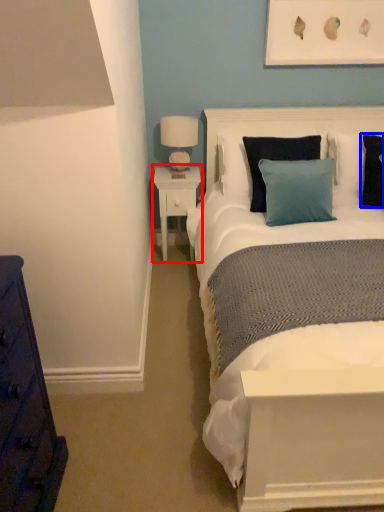
Question: Among these objects, which one is farthest to the camera, nightstand (highlighted by a red box) or pillow (highlighted by a blue box)?

Choices:
 (A) nightstand
 (B) pillow

Answer: (A)